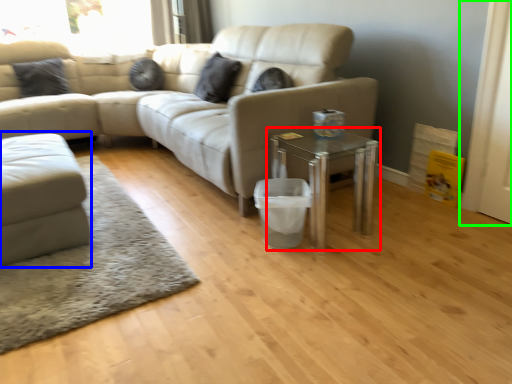
Question: Estimate the real-world distances between objects in this image. Which object is farther from table (highlighted by a red box), studio couch (highlighted by a blue box) or screen door (highlighted by a green box)?

Choices:
 (A) studio couch
 (B) screen door

Answer: (A)